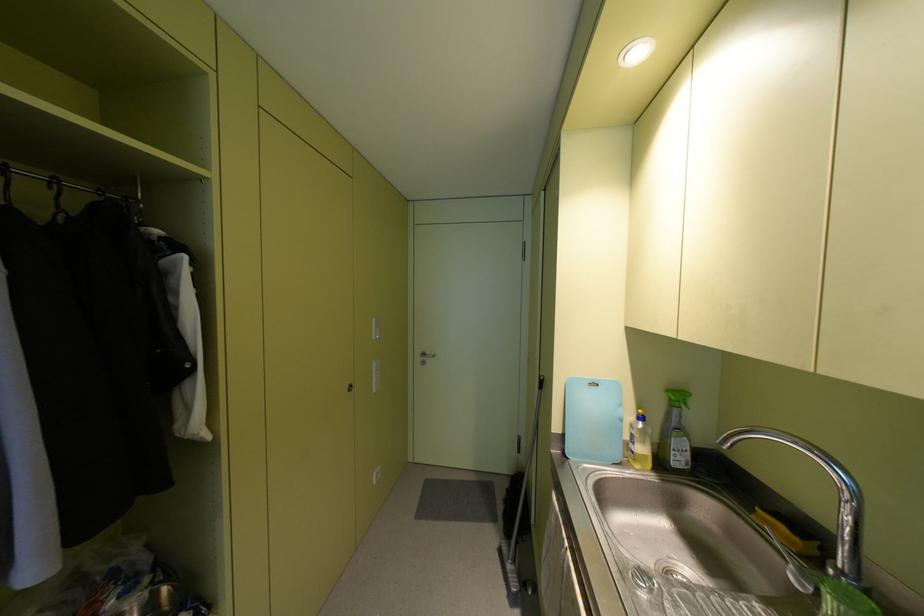
Identify the location of broom handle. (526, 472).